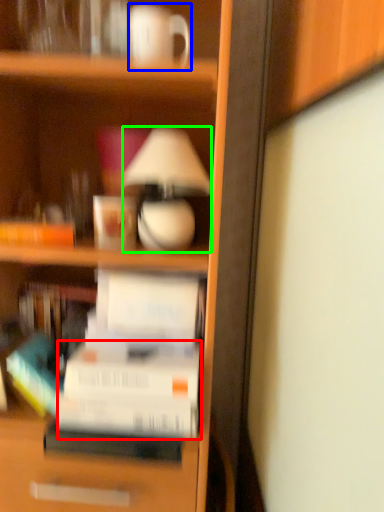
Question: Which object is positioned closest to paperback book (highlighted by a red box)? Select from coffee cup (highlighted by a blue box) and lamp (highlighted by a green box).

Choices:
 (A) coffee cup
 (B) lamp

Answer: (B)